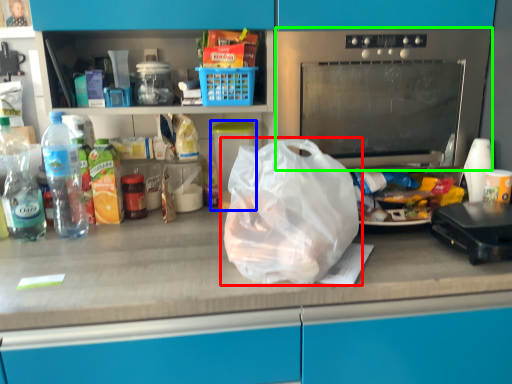
Question: Which object is the closest to the plastic bag (highlighted by a red box)? Choose among these: appliance (highlighted by a blue box) or home appliance (highlighted by a green box).

Choices:
 (A) appliance
 (B) home appliance

Answer: (B)